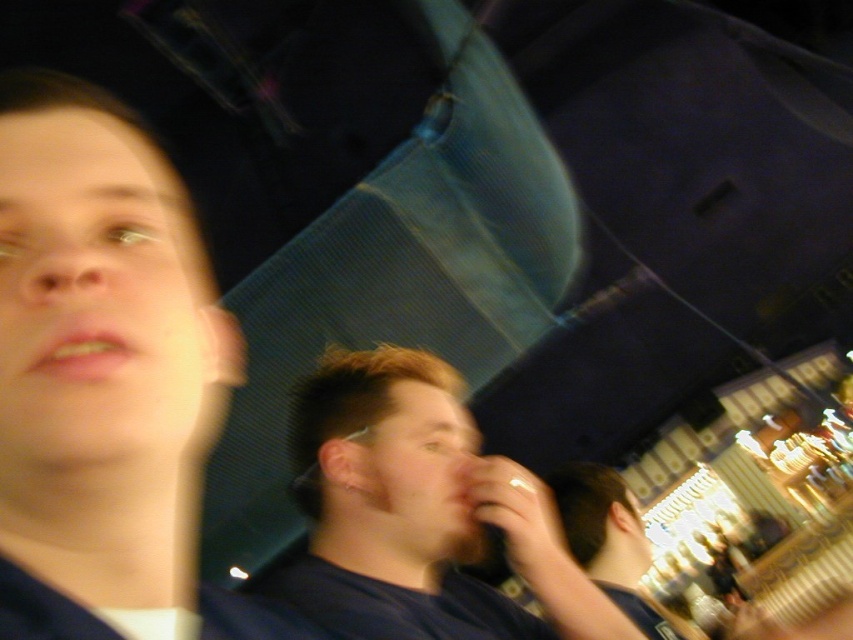
Question: Is smooth skin face at upper left thinner than dark blue shirt at center?

Choices:
 (A) yes
 (B) no

Answer: (A)

Question: Which of the following is the closest to the observer?

Choices:
 (A) smooth skin face at upper left
 (B) dark blue shirt at center
 (C) dark blue t-shirt at center

Answer: (A)

Question: Based on their relative distances, which object is nearer to the dark blue shirt at center?

Choices:
 (A) dark blue t-shirt at center
 (B) smooth skin face at upper left

Answer: (A)

Question: Where is smooth skin face at upper left located in relation to dark blue shirt at center in the image?

Choices:
 (A) right
 (B) left

Answer: (B)

Question: Among these objects, which one is farthest from the camera?

Choices:
 (A) dark blue t-shirt at center
 (B) smooth skin face at upper left
 (C) dark blue shirt at center

Answer: (C)

Question: Can you confirm if dark blue t-shirt at center is bigger than dark blue shirt at center?

Choices:
 (A) no
 (B) yes

Answer: (B)